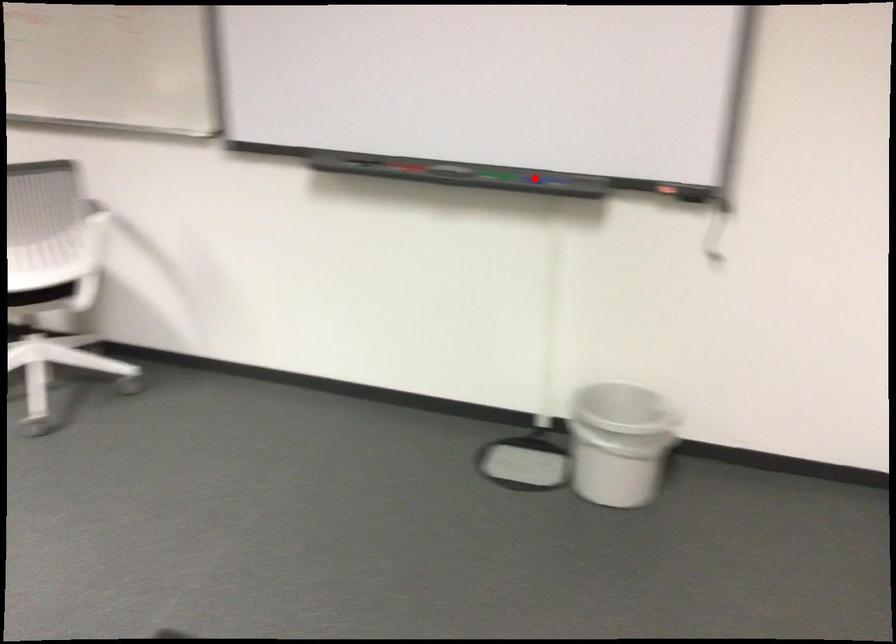
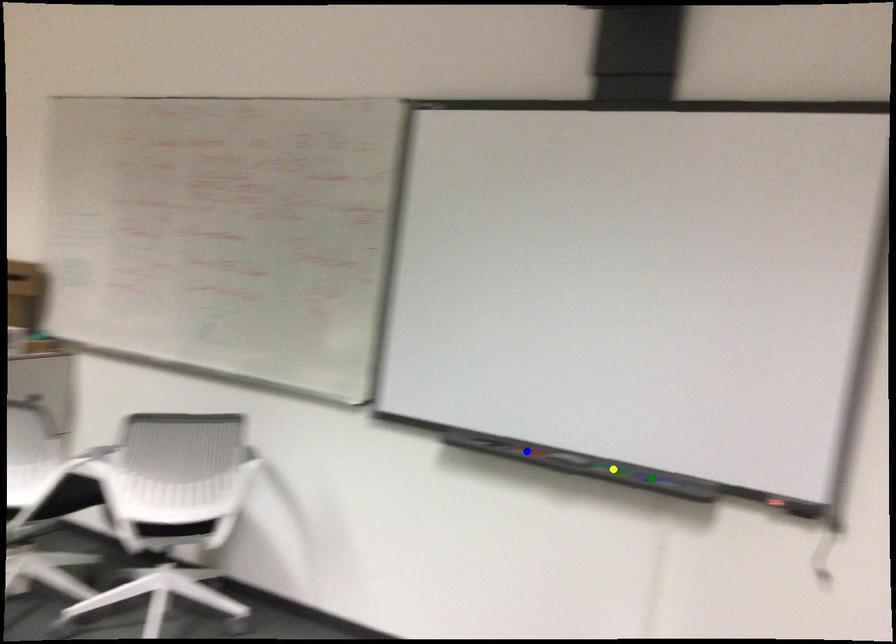
Question: I am providing you with two images of the same scene from different viewpoints. A red point is marked on the first image. You are given multiple points on the second image. Which spot in image 2 lines up with the point in image 1?

Choices:
 (A) green point
 (B) blue point
 (C) yellow point

Answer: (A)